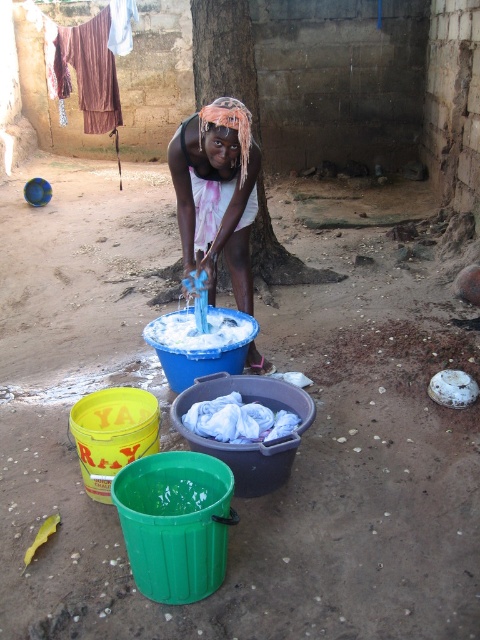
You are a person trying to hang laundry on a tree trunk. You have a white fabric at center and a brown rough tree trunk at center. Which object should you place the laundry on?

The white fabric at center should be placed on the brown rough tree trunk at center, as the white fabric is positioned on the right side of the tree trunk, indicating it is the laundry to be hung.

You are a painter standing in front of the tree trunk and need to hang a large white cloth to dry. Based on the scene description, will the white fabric at center be tall enough to cover the entire height of the brown rough tree trunk at center?

The white fabric at center is much taller than the brown rough tree trunk at center, so it will be tall enough to cover the entire height of the tree trunk.